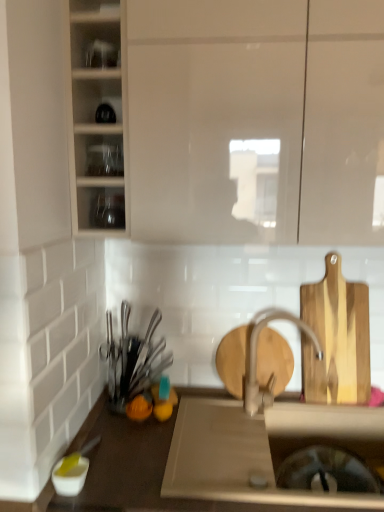
Question: Do you think clear glass shelves at upper left, which appears as the 2th shelf when ordered from the bottom, is within matte white cabinet at upper center, the 1th cabinetry in the right-to-left sequence, or outside of it?

Choices:
 (A) inside
 (B) outside

Answer: (B)

Question: Is clear glass shelves at upper left, acting as the second shelf starting from the top, taller or shorter than matte white cabinet at upper center, the 1th cabinetry in the right-to-left sequence?

Choices:
 (A) tall
 (B) short

Answer: (B)

Question: Based on their relative distances, which object is farther from the wooden cutting board at right?

Choices:
 (A) clear glass jars at upper left, which appears as the first shelf when viewed from the top
 (B) matte white cabinet at upper center, which appears as the 2th cabinetry when viewed from the left
 (C) clear glass shelves at upper left, which appears as the 2th shelf when ordered from the bottom
 (D) white glossy bowl at lower left, acting as the second tableware starting from the back
 (E) matte white cabinet at upper left, which appears as the second cabinetry when viewed from the right

Answer: (A)

Question: Considering the real-world distances, which object is farthest from the clear glass jars at upper left, which appears as the first shelf when viewed from the top?

Choices:
 (A) transparent glass bottles at upper left, positioned as the 3th shelf in top-to-bottom order
 (B) wooden cutting board at right
 (C) white glossy bowl at lower left, which is the 2th tableware in right-to-left order
 (D) matte silver faucet at center
 (E) shiny metallic utensils at left, placed as the second tableware when sorted from front to back

Answer: (C)